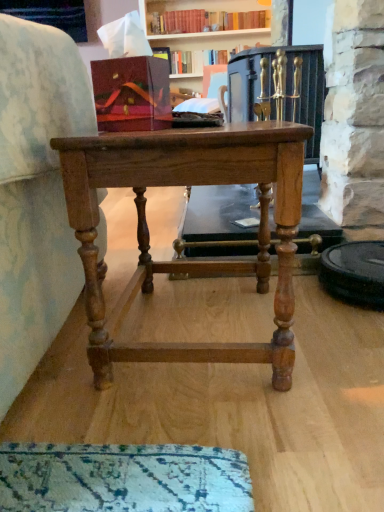
Question: From a real-world perspective, relative to matte wood cabinet at upper left, is hardcover book at upper center vertically above or below?

Choices:
 (A) below
 (B) above

Answer: (A)

Question: Considering the positions of point pos(246,45) and point pos(19,1), is point pos(246,45) closer or farther from the camera than point pos(19,1)?

Choices:
 (A) closer
 (B) farther

Answer: (B)

Question: Which of these objects is positioned farthest from the light brown wood table at center?

Choices:
 (A) matte wood cabinet at upper left
 (B) hardcover book at upper center

Answer: (A)

Question: Which object is the farthest from the hardcover book at upper center?

Choices:
 (A) matte wood cabinet at upper left
 (B) light brown wood table at center

Answer: (B)